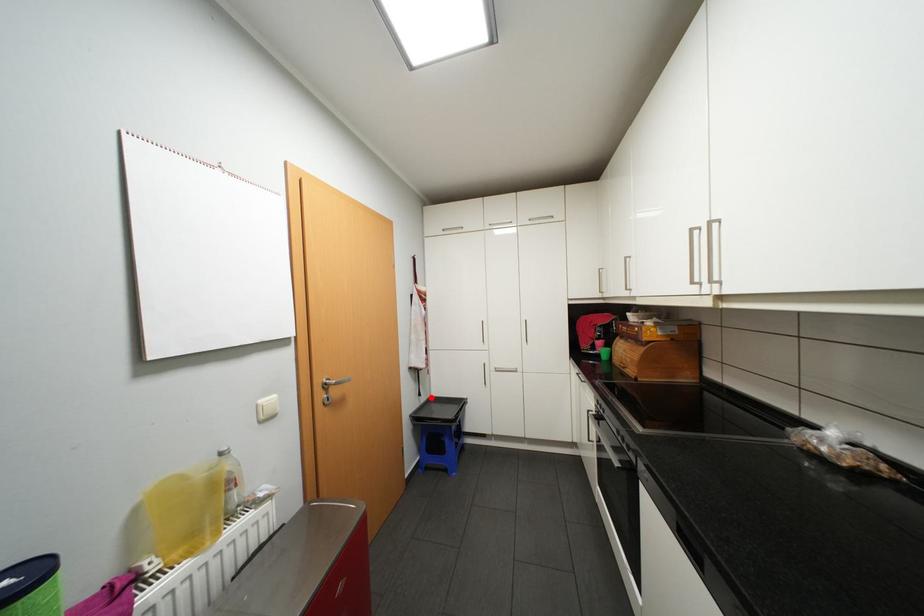
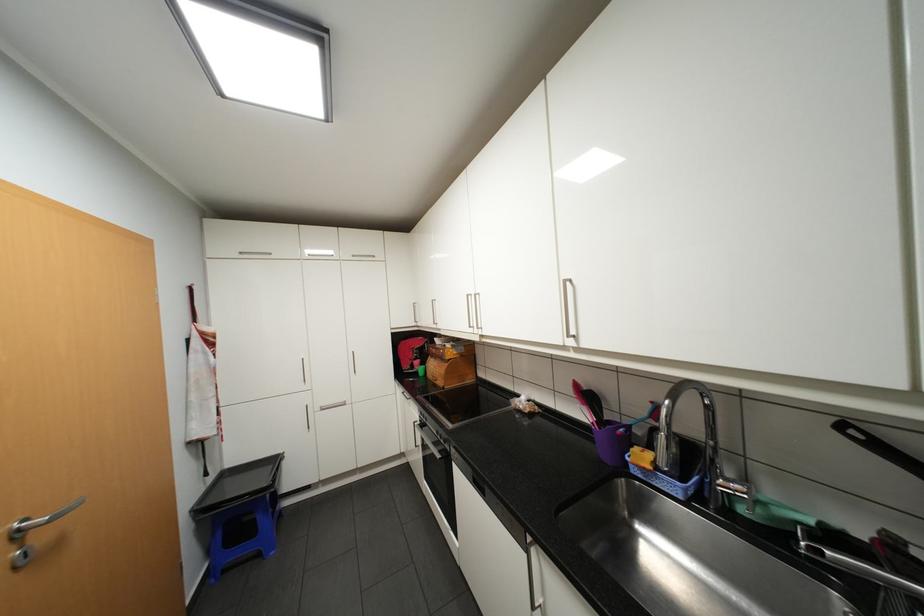
Question: I am providing you with two images of the same scene from different viewpoints. Image1 has a red point marked. In image2, the corresponding 3D location appears at what relative position? Reply with the corresponding letter.

Choices:
 (A) Closer
 (B) Farther

Answer: (A)